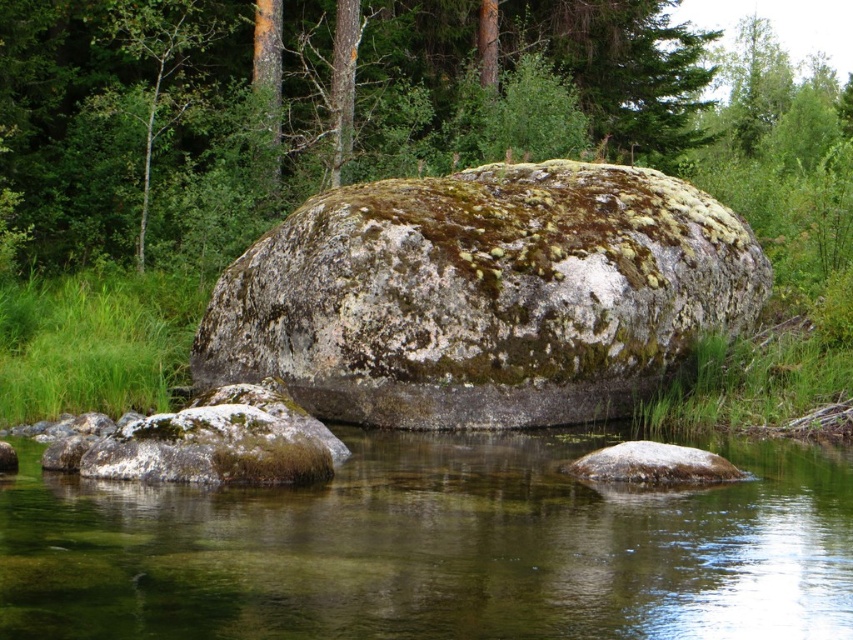
From the picture: Who is more forward, (321, 225) or (637, 458)?

Point (637, 458) is in front.

Which of these two, green mossy rock at center or smooth gray rock at center, stands shorter?

Standing shorter between the two is smooth gray rock at center.

Locate an element on the screen. The width and height of the screenshot is (853, 640). green mossy rock at center is located at coordinates [x=483, y=296].

Where is `green mossy rock at center`? green mossy rock at center is located at coordinates (483, 296).

Is clear water at center thinner than green mossy rock at center?

In fact, clear water at center might be wider than green mossy rock at center.

Measure the distance between clear water at center and green mossy rock at center.

A distance of 16.01 feet exists between clear water at center and green mossy rock at center.

Who is more distant from viewer, (730, 573) or (299, 394)?

The point (299, 394) is behind.

Locate an element on the screen. This screenshot has width=853, height=640. clear water at center is located at coordinates (436, 548).

Does clear water at center appear over green mossy rock at lower left?

Actually, clear water at center is below green mossy rock at lower left.

Is clear water at center smaller than green mossy rock at lower left?

Actually, clear water at center might be larger than green mossy rock at lower left.

Find the location of a particular element. This screenshot has width=853, height=640. clear water at center is located at coordinates (436, 548).